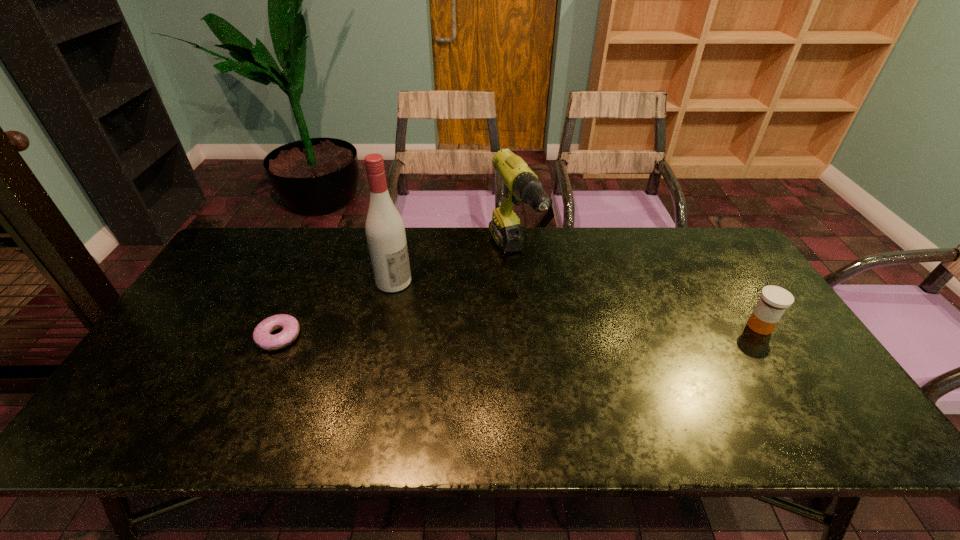
Locate an element on the screen. doughnut is located at coordinates (262, 337).

Where is `the leftmost object`? The height and width of the screenshot is (540, 960). the leftmost object is located at coordinates (262, 337).

The width and height of the screenshot is (960, 540). Identify the location of the rightmost object. (774, 300).

Locate an element on the screen. Image resolution: width=960 pixels, height=540 pixels. the third tallest object is located at coordinates (774, 300).

Identify the location of alcohol. The image size is (960, 540). 385,231.

Locate an element on the screen. the third object from right to left is located at coordinates (385, 231).

This screenshot has width=960, height=540. In order to click on drill in this screenshot , I will do `click(521, 184)`.

Where is `the third shortest object`? the third shortest object is located at coordinates (521, 184).

Find the location of a particular element. vacant space situated 0.100m on the left of the shortest object is located at coordinates point(220,336).

Where is `vacant space located 0.200m on the label of the third tallest object`? This screenshot has height=540, width=960. vacant space located 0.200m on the label of the third tallest object is located at coordinates (808, 401).